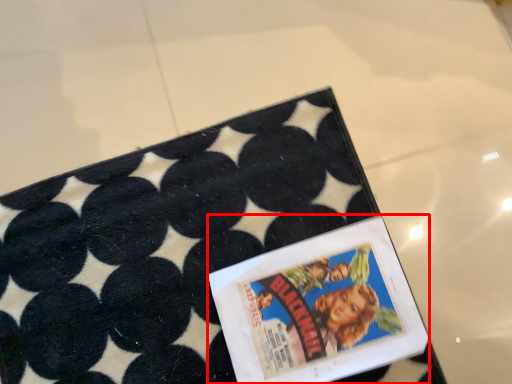
Question: From the image's perspective, considering the relative positions of comic book (annotated by the red box) and tray in the image provided, where is comic book (annotated by the red box) located with respect to the staircase?

Choices:
 (A) below
 (B) above

Answer: (A)